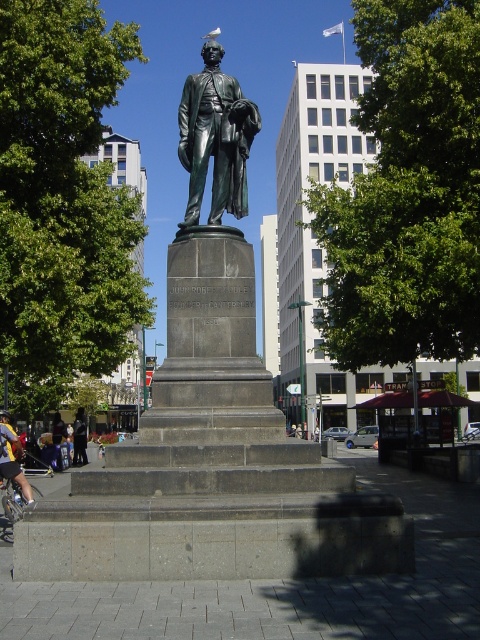
Question: Estimate the real-world distances between objects in this image. Which object is closer to the dark gray suit at center?

Choices:
 (A) green-bronze statue at center
 (B) yellow fabric at lower left

Answer: (B)

Question: Can you confirm if green-bronze statue at center is positioned to the right of dark gray suit at center?

Choices:
 (A) yes
 (B) no

Answer: (A)

Question: Based on their relative distances, which object is nearer to the dark gray suit at center?

Choices:
 (A) green-bronze statue at center
 (B) yellow fabric at lower left

Answer: (B)

Question: Is yellow fabric at lower left positioned before dark gray suit at center?

Choices:
 (A) yes
 (B) no

Answer: (A)

Question: Which point is farther from the camera taking this photo?

Choices:
 (A) (83, 456)
 (B) (196, 157)

Answer: (A)

Question: Is yellow fabric at lower left bigger than dark gray suit at center?

Choices:
 (A) no
 (B) yes

Answer: (A)